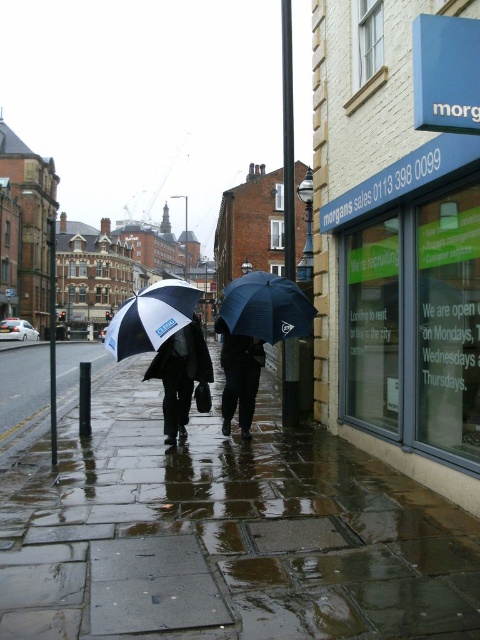
You are a delivery person trying to navigate through the rain. You see two umbrellas in the image, the dark blue matte umbrella at center and the white and black umbrella at center. Which umbrella would provide taller coverage to protect you from the rain?

The white and black umbrella at center is taller than the dark blue matte umbrella at center, so it would provide taller coverage to protect you from the rain.

You are standing on the sidewalk in the rainy scene. Where exactly is the wet stone pavement at lower center located in terms of coordinates?

The wet stone pavement at lower center is located at point coordinates of (225,534).

Consider the image. You are a delivery person trying to navigate through the rain. You notice two umbrellas held by pedestrians ahead of you. The umbrellas are the white and black umbrella at center and the dark blue fabric umbrella at center. Which umbrella is taller?

The white and black umbrella at center is taller than the dark blue fabric umbrella at center.